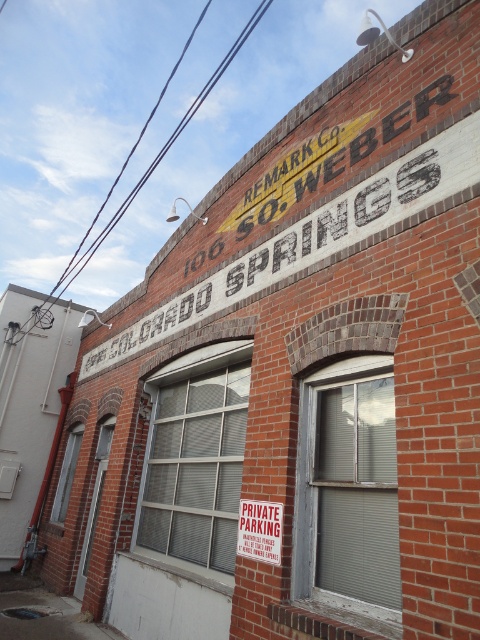
You are a window installer who needs to replace the glass for two windows in the building described. You have two pieces of glass, one large and one small. Which piece should be used for the clear glass window at center and which for the clear glass window at lower left?

The clear glass window at center has a larger size compared to the clear glass window at lower left, so the large glass should be used for the clear glass window at center and the small one for the clear glass window at lower left.

You are standing in front of the brick building and want to estimate how far the clear glass window at center is from you. Based on the scene, can you determine the approximate distance?

The clear glass window at center is approximately 4.67 meters away from the viewer.